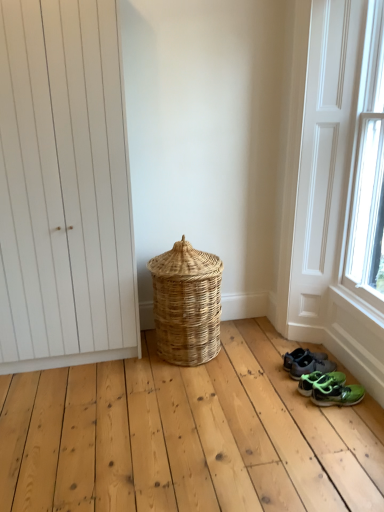
Question: Is green rubber sandals at lower right, the second footwear from the front, in front of or behind green fabric sneakers at lower right, which ranks as the 1th footwear in back-to-front order, in the image?

Choices:
 (A) front
 (B) behind

Answer: (A)

Question: Considering the positions of green rubber sandals at lower right, arranged as the 2th footwear when viewed from the back, and green fabric sneakers at lower right, which ranks as the 1th footwear in back-to-front order, in the image, is green rubber sandals at lower right, arranged as the 2th footwear when viewed from the back, wider or thinner than green fabric sneakers at lower right, which ranks as the 1th footwear in back-to-front order,?

Choices:
 (A) wide
 (B) thin

Answer: (A)

Question: Which object is positioned farthest from the natural woven basket at center?

Choices:
 (A) green matte sneakers at lower right, marked as the third footwear in a back-to-front arrangement
 (B) green rubber sandals at lower right, arranged as the 2th footwear when viewed from the back
 (C) green fabric sneakers at lower right, placed as the third footwear when sorted from front to back
 (D) white matte door at left
 (E) white wood screen door at lower right

Answer: (A)

Question: Which of these objects is positioned closest to the natural woven basket at center?

Choices:
 (A) green fabric sneakers at lower right, which ranks as the 1th footwear in back-to-front order
 (B) green rubber sandals at lower right, arranged as the 2th footwear when viewed from the back
 (C) green matte sneakers at lower right, which appears as the 1th footwear when viewed from the front
 (D) white matte door at left
 (E) white wood screen door at lower right

Answer: (D)